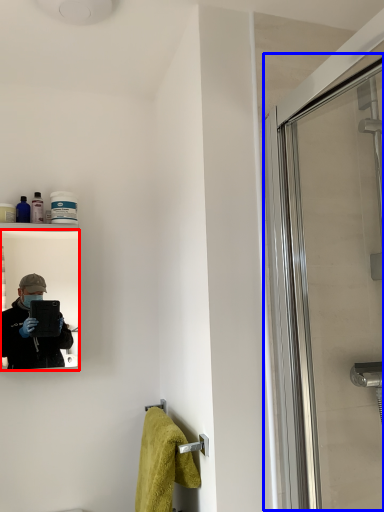
Question: Which point is further to the camera, mirror (highlighted by a red box) or screen door (highlighted by a blue box)?

Choices:
 (A) mirror
 (B) screen door

Answer: (A)